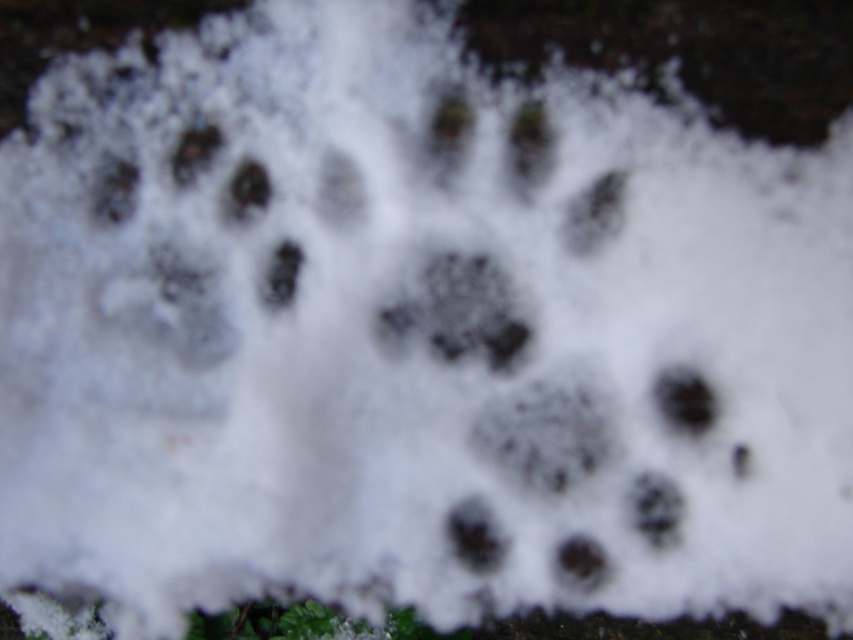
Question: In this image, where is dark textured paw print at center located relative to black rubber footprint at lower right?

Choices:
 (A) right
 (B) left

Answer: (B)

Question: Can you confirm if dark textured paw print at center is positioned to the left of black rubber footprint at lower right?

Choices:
 (A) yes
 (B) no

Answer: (A)

Question: Is dark textured paw print at center thinner than black rubber footprint at lower right?

Choices:
 (A) no
 (B) yes

Answer: (A)